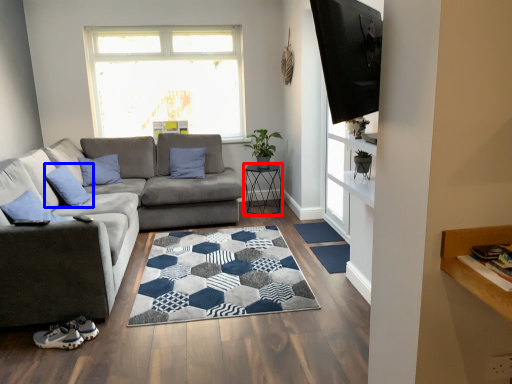
Question: Which of the following is the closest to the observer, table (highlighted by a red box) or pillow (highlighted by a blue box)?

Choices:
 (A) table
 (B) pillow

Answer: (B)